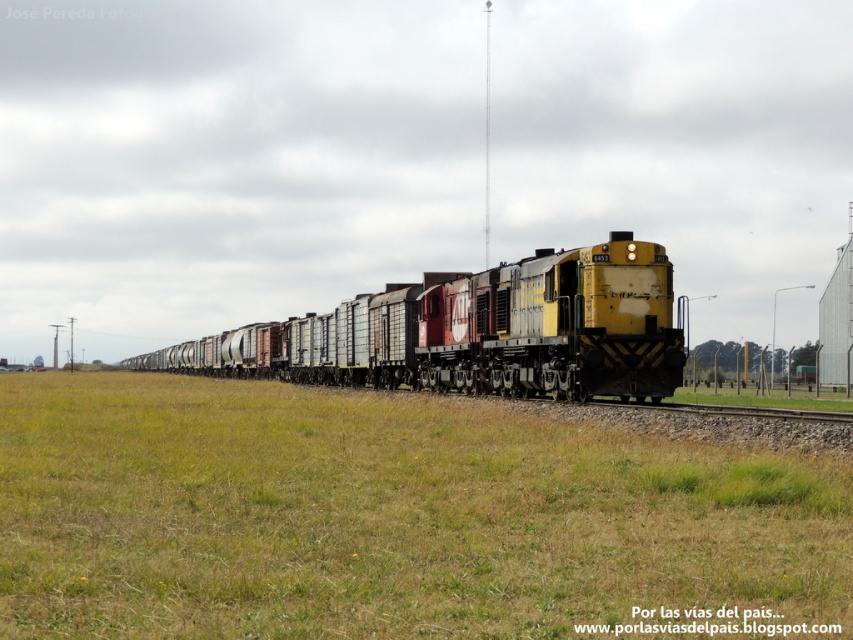
Question: Is green grass at center wider than yellow matte train at center?

Choices:
 (A) no
 (B) yes

Answer: (A)

Question: Which point is closer to the camera taking this photo?

Choices:
 (A) (374, 433)
 (B) (402, 374)

Answer: (A)

Question: Does green grass at center have a lesser width compared to yellow matte train at center?

Choices:
 (A) no
 (B) yes

Answer: (B)

Question: Which point appears closest to the camera in this image?

Choices:
 (A) (0, 417)
 (B) (614, 250)

Answer: (A)

Question: Does green grass at center appear over yellow matte train at center?

Choices:
 (A) yes
 (B) no

Answer: (B)